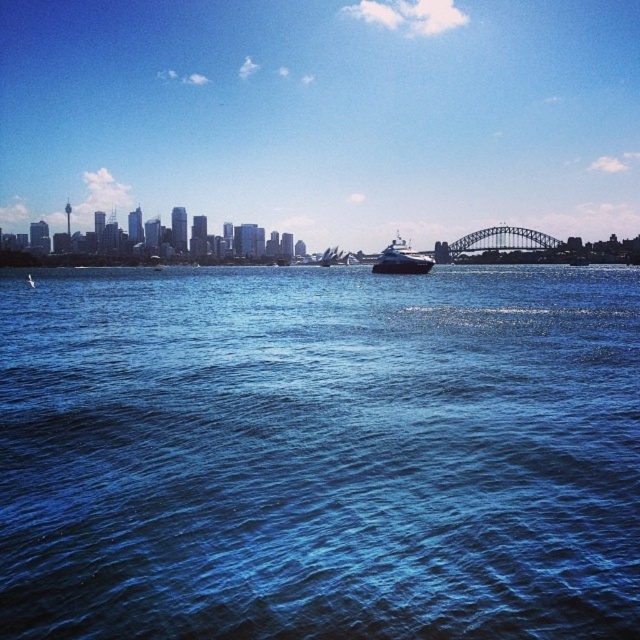
You are standing on the deck of the large dark yacht near center right and want to pour a glass of water. You see the blue liquid water at center represented by point (320, 452). Can you pour the water into the glass without spilling it?

The blue liquid water at center represented by point (320, 452) is the harbor water, so you should not pour it into the glass as it is not drinking water.

You are a passenger on the shiny black yacht at center. You want to see the blue liquid water at center. Which direction should you look?

The blue liquid water at center is positioned under the shiny black yacht at center, so you should look downward to see the blue liquid water at center.

You are standing at the point with coordinates point (92, 637) and want to walk to the point with coordinates point (416, 257). Which direction should you move to reach your destination?

You should move backward to reach point (416, 257) from point (92, 637) because point (92, 637) is in front of point (416, 257).